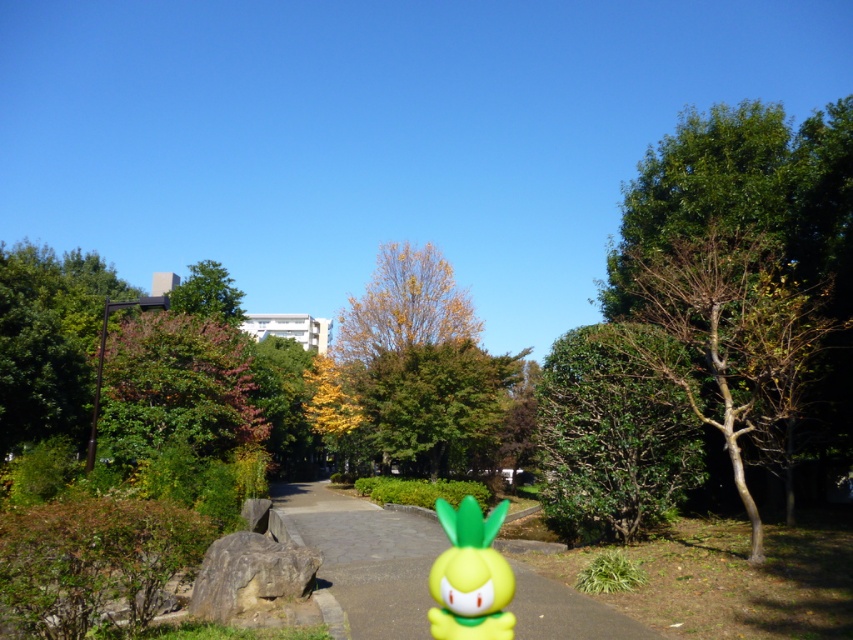
Question: Estimate the real-world distances between objects in this image. Which object is farther from the green leafy tree at upper center?

Choices:
 (A) brown/dry wood tree at right
 (B) yellow leafy tree at center

Answer: (A)

Question: Is smooth concrete pavement at center positioned at the back of green leafy tree at upper center?

Choices:
 (A) yes
 (B) no

Answer: (B)

Question: Does brown/dry wood tree at right appear on the right side of yellow leafy tree at center?

Choices:
 (A) no
 (B) yes

Answer: (B)

Question: Based on their relative distances, which object is farther from the green leafy tree at upper center?

Choices:
 (A) yellow leafy tree at center
 (B) brown/dry wood tree at right
 (C) smooth concrete pavement at center

Answer: (B)

Question: Does brown/dry wood tree at right appear over green leafy tree at right?

Choices:
 (A) yes
 (B) no

Answer: (A)

Question: Which point is farther to the camera?

Choices:
 (A) green leafy tree at upper center
 (B) smooth concrete pavement at center
 (C) matte yellow toy at center

Answer: (A)